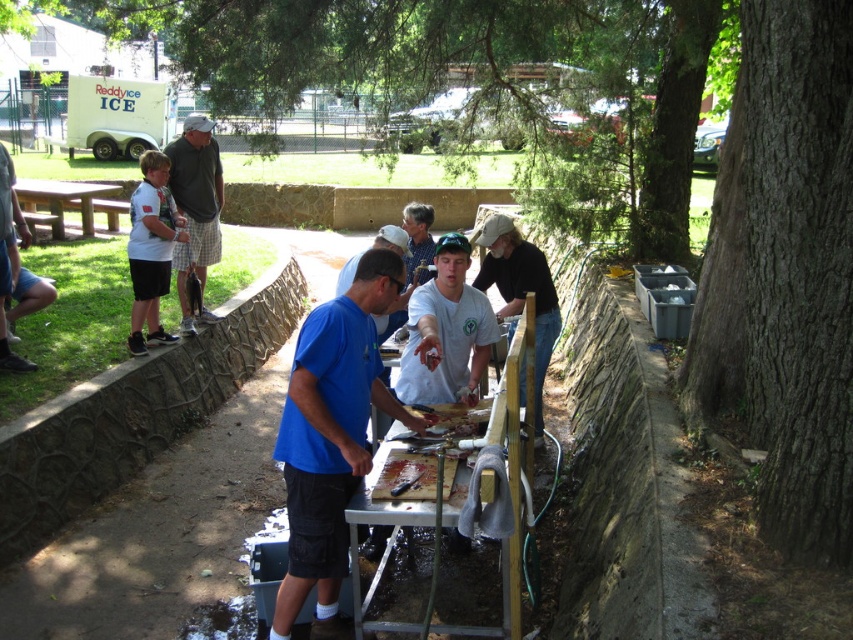
Question: Which object is farther from the camera taking this photo?

Choices:
 (A) blue shirt at center
 (B) white matte shirt at center

Answer: (A)

Question: Does gray flannel shirt at upper left appear over brown wooden table at left?

Choices:
 (A) no
 (B) yes

Answer: (A)

Question: Which of these objects is positioned farthest from the blue fabric shirt at center?

Choices:
 (A) white matte shirt at center
 (B) brown wooden table at left

Answer: (B)

Question: Which object is farther from the camera taking this photo?

Choices:
 (A) gray flannel shirt at upper left
 (B) green rough bark tree at right

Answer: (A)

Question: Does white cotton shirt at left have a larger size compared to white matte shirt at center?

Choices:
 (A) no
 (B) yes

Answer: (A)

Question: From the image, what is the correct spatial relationship of white cotton shirt at left in relation to blue shirt at center?

Choices:
 (A) below
 (B) above

Answer: (B)